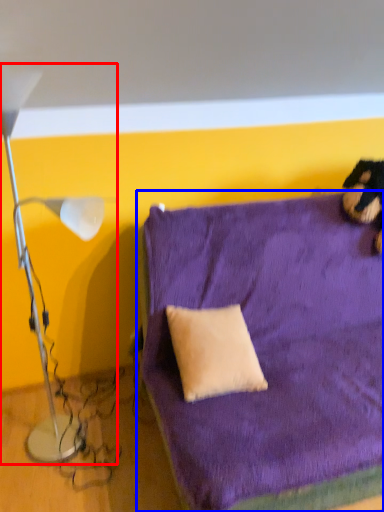
Question: Which of the following is the farthest to the observer, lamp (highlighted by a red box) or furniture (highlighted by a blue box)?

Choices:
 (A) lamp
 (B) furniture

Answer: (B)